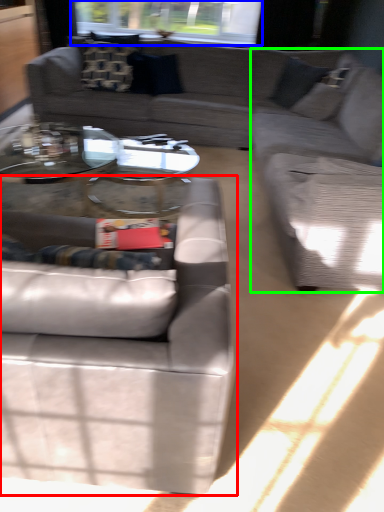
Question: Based on their relative distances, which object is nearer to studio couch (highlighted by a red box)? Choose from window screen (highlighted by a blue box) and couch (highlighted by a green box).

Choices:
 (A) window screen
 (B) couch

Answer: (B)